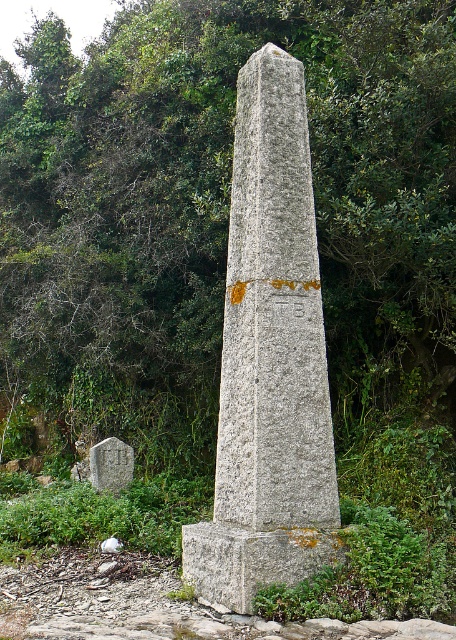
Identify the location of gray stone obelisk at center. Image resolution: width=456 pixels, height=640 pixels. (269, 360).

Does gray stone obelisk at center have a larger size compared to gray concrete at lower left?

Yes, gray stone obelisk at center is bigger than gray concrete at lower left.

Measure the distance between gray stone obelisk at center and camera.

gray stone obelisk at center is 5.30 meters from camera.

You are a GUI agent. You are given a task and a screenshot of the screen. Output one action in this format:
    pyautogui.click(x=<x>, y=<y>)
    Task: Click on the gray stone obelisk at center
    
    Given the screenshot: What is the action you would take?
    pyautogui.click(x=269, y=360)